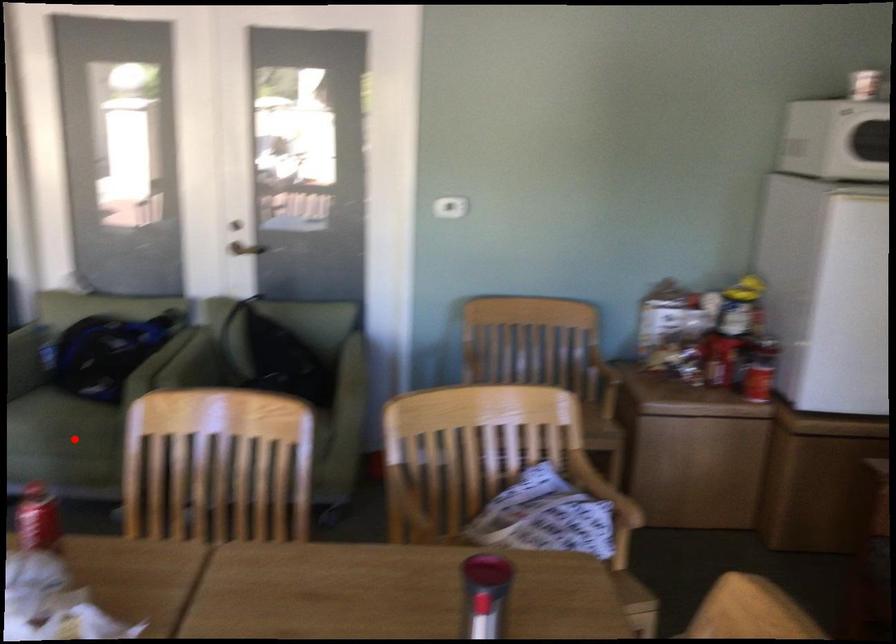
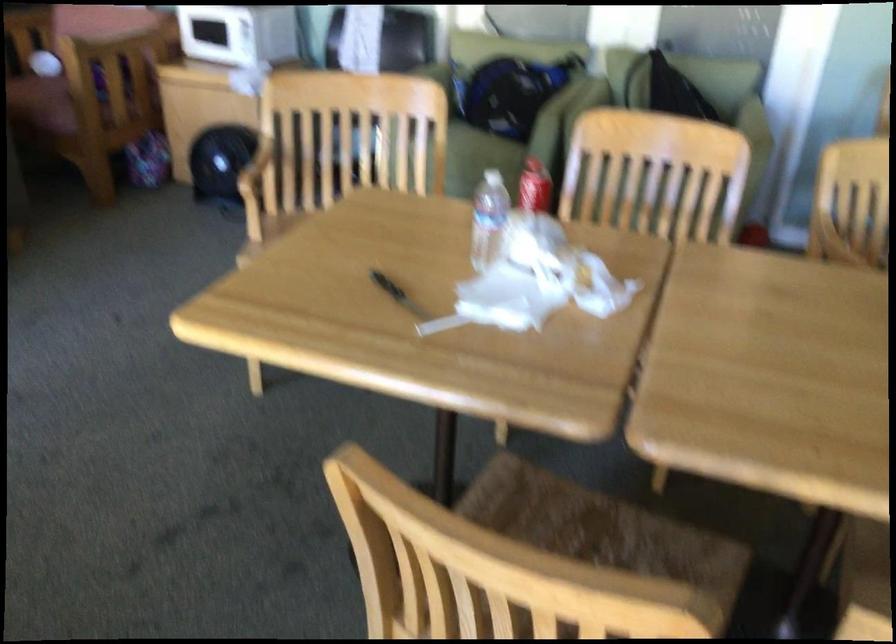
Find the pixel in the second image that matches the highlighted location in the first image.

(479, 160)